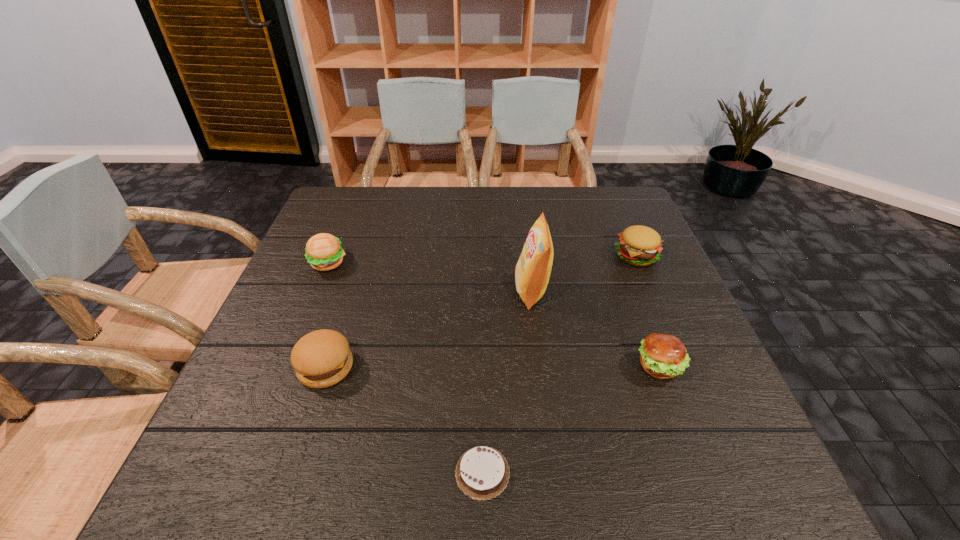
This screenshot has width=960, height=540. I want to click on crisp (potato chip), so click(x=532, y=272).

Where is `the tallest object`? This screenshot has width=960, height=540. the tallest object is located at coordinates (532, 272).

Locate an element on the screen. This screenshot has width=960, height=540. the fourth object from right to left is located at coordinates (482, 473).

The image size is (960, 540). In order to click on the nearest object in this screenshot , I will do `click(482, 473)`.

Locate an element on the screen. Image resolution: width=960 pixels, height=540 pixels. vacant area situated 0.110m on the front-facing side of the tallest object is located at coordinates (469, 291).

This screenshot has height=540, width=960. I want to click on vacant space positioned on the front-facing side of the tallest object, so click(433, 291).

Image resolution: width=960 pixels, height=540 pixels. Identify the location of vacant area situated on the front-facing side of the tallest object. (404, 291).

Find the location of `vacant region located on the left of the shortest object`. vacant region located on the left of the shortest object is located at coordinates (240, 472).

In order to click on object situated at the near edge in this screenshot , I will do `click(482, 473)`.

In the image, there is a desktop. Identify the location of vacant space at the far edge. click(x=445, y=190).